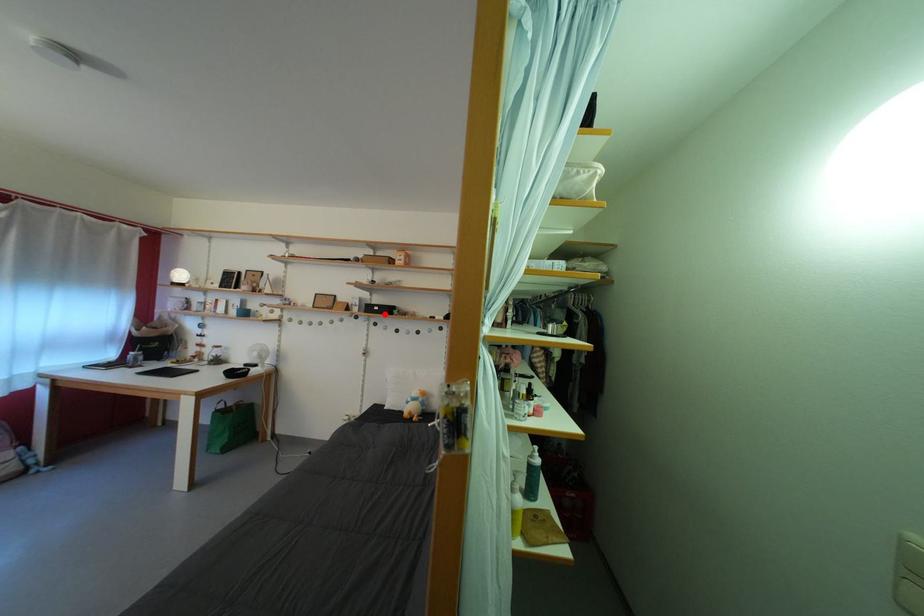
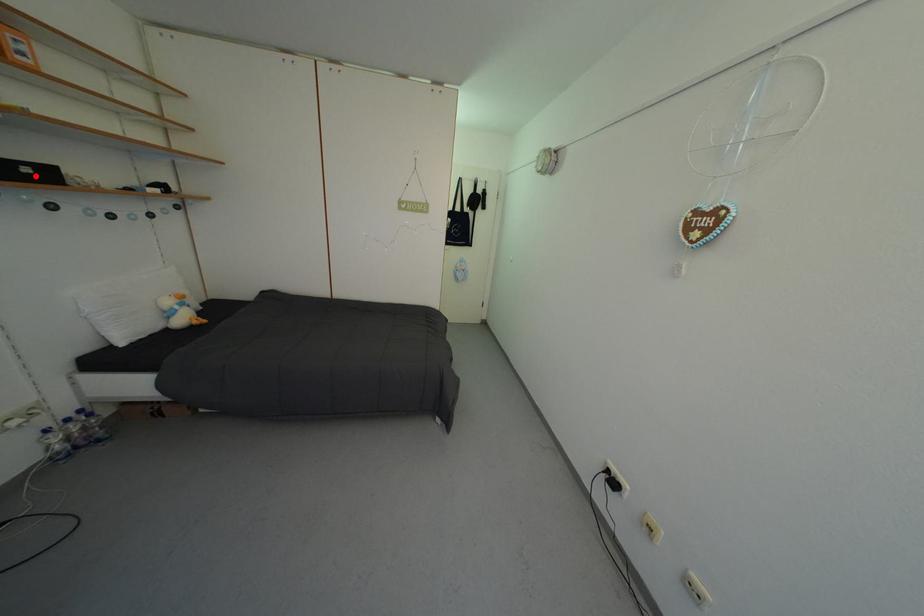
I am providing you with two images of the same scene from different viewpoints. A red point is marked on the first image and another point is marked on the second image. Do the highlighted points in image1 and image2 indicate the same real-world spot?

Yes